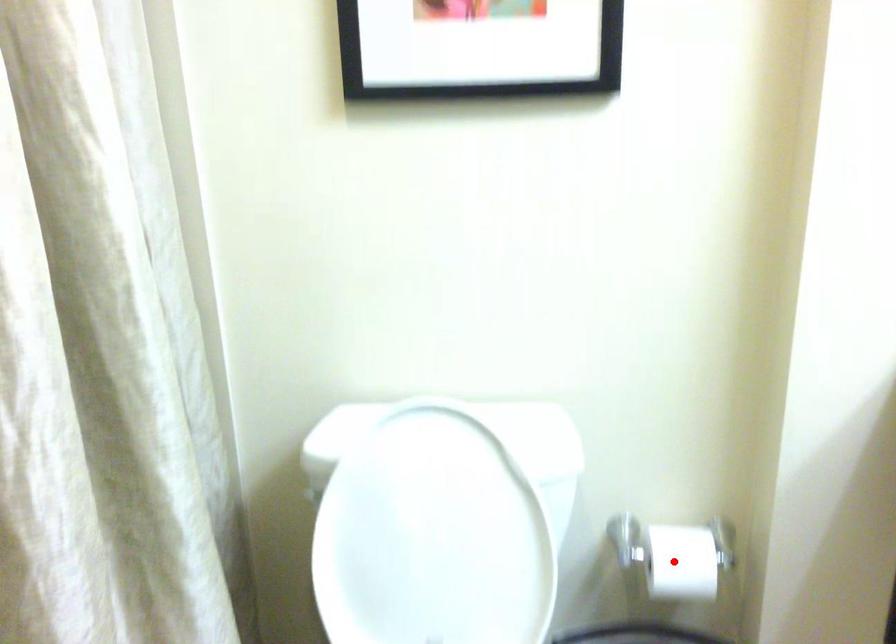
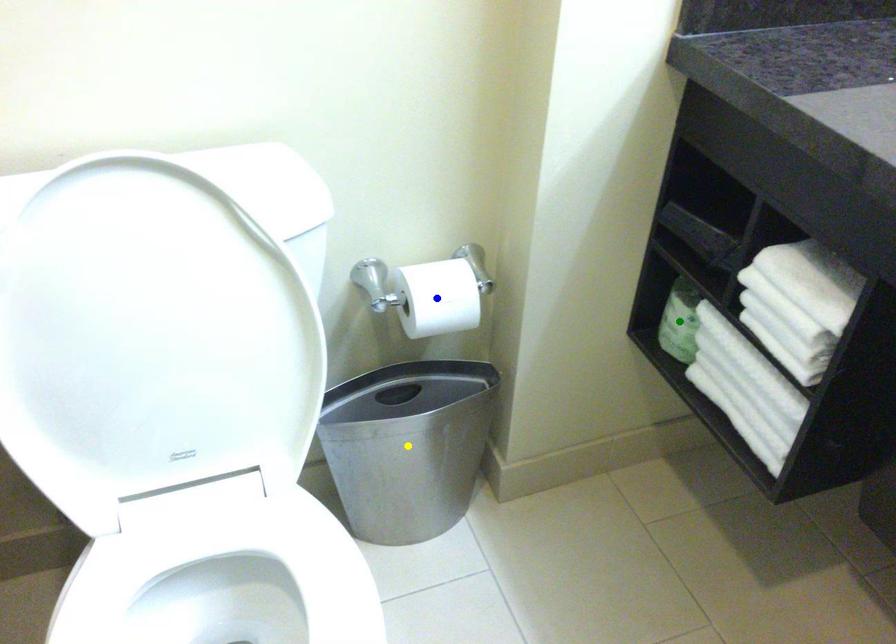
Question: I am providing you with two images of the same scene from different viewpoints. A red point is marked on the first image. You are given multiple points on the second image. Can you choose the point in image 2 that corresponds to the point in image 1?

Choices:
 (A) blue point
 (B) green point
 (C) yellow point

Answer: (A)